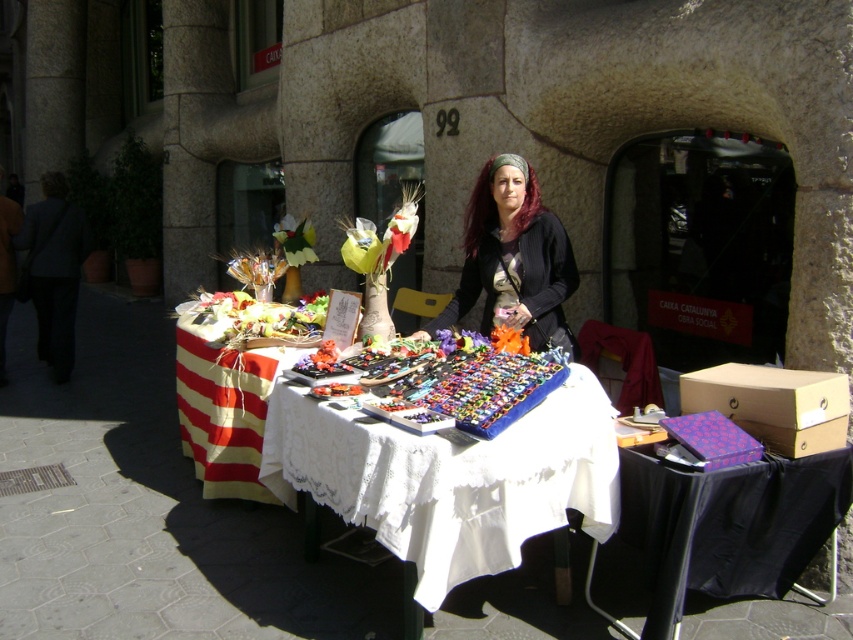
Question: Which of the following is the farthest from the observer?

Choices:
 (A) (689, 548)
 (B) (299, 369)

Answer: (B)

Question: Which point appears farthest from the camera in this image?

Choices:
 (A) (311, 365)
 (B) (554, 339)

Answer: (B)

Question: Which point appears farthest from the camera in this image?

Choices:
 (A) (340, 369)
 (B) (500, 342)

Answer: (A)

Question: Does purple fabric box at lower right have a larger size compared to matte black jacket at center?

Choices:
 (A) no
 (B) yes

Answer: (B)

Question: Observing the image, what is the correct spatial positioning of red striped fabric at lower left in reference to matte orange flower at center?

Choices:
 (A) below
 (B) above

Answer: (A)

Question: Can you confirm if purple fabric box at lower right is positioned below purple fabric flower at center?

Choices:
 (A) no
 (B) yes

Answer: (B)